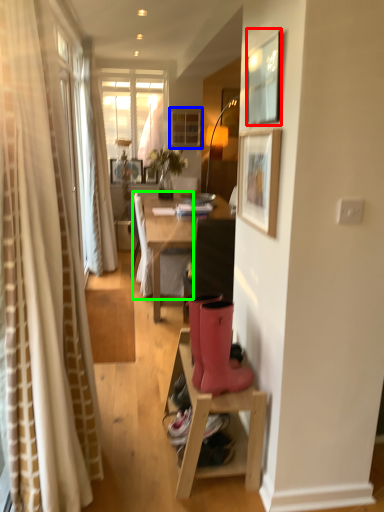
Question: Estimate the real-world distances between objects in this image. Which object is closer to picture frame (highlighted by a red box), cabinetry (highlighted by a blue box) or chair (highlighted by a green box)?

Choices:
 (A) cabinetry
 (B) chair

Answer: (B)